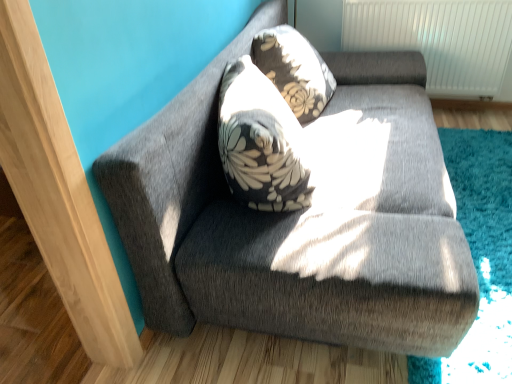
Question: Are floral-patterned fabric pillow at upper center and textured gray couch at upper center located far from each other?

Choices:
 (A) yes
 (B) no

Answer: (B)

Question: From the image's perspective, does floral-patterned fabric pillow at upper center appear lower than textured gray couch at upper center?

Choices:
 (A) no
 (B) yes

Answer: (A)

Question: Would you say floral-patterned fabric pillow at upper center is outside textured gray couch at upper center?

Choices:
 (A) no
 (B) yes

Answer: (A)

Question: Could you tell me if floral-patterned fabric pillow at upper center is facing textured gray couch at upper center?

Choices:
 (A) yes
 (B) no

Answer: (A)

Question: Is textured gray couch at upper center located within floral-patterned fabric pillow at upper center?

Choices:
 (A) no
 (B) yes

Answer: (A)

Question: From a real-world perspective, does floral-patterned fabric pillow at upper center sit lower than textured gray couch at upper center?

Choices:
 (A) yes
 (B) no

Answer: (B)

Question: Could you tell me if textured gray couch at upper center is turned towards floral-patterned fabric pillow at upper center?

Choices:
 (A) no
 (B) yes

Answer: (B)

Question: Can you confirm if textured gray couch at upper center is wider than floral-patterned fabric pillow at upper center?

Choices:
 (A) yes
 (B) no

Answer: (A)

Question: Is floral-patterned fabric pillow at upper center at the back of textured gray couch at upper center?

Choices:
 (A) no
 (B) yes

Answer: (B)

Question: Can you confirm if textured gray couch at upper center is taller than floral-patterned fabric pillow at upper center?

Choices:
 (A) yes
 (B) no

Answer: (A)

Question: Is textured gray couch at upper center closer to camera compared to floral-patterned fabric pillow at upper center?

Choices:
 (A) no
 (B) yes

Answer: (B)

Question: Does textured gray couch at upper center have a lesser height compared to floral-patterned fabric pillow at upper center?

Choices:
 (A) no
 (B) yes

Answer: (A)

Question: Based on their sizes in the image, would you say floral-patterned fabric pillow at upper center is bigger or smaller than textured gray couch at upper center?

Choices:
 (A) big
 (B) small

Answer: (B)